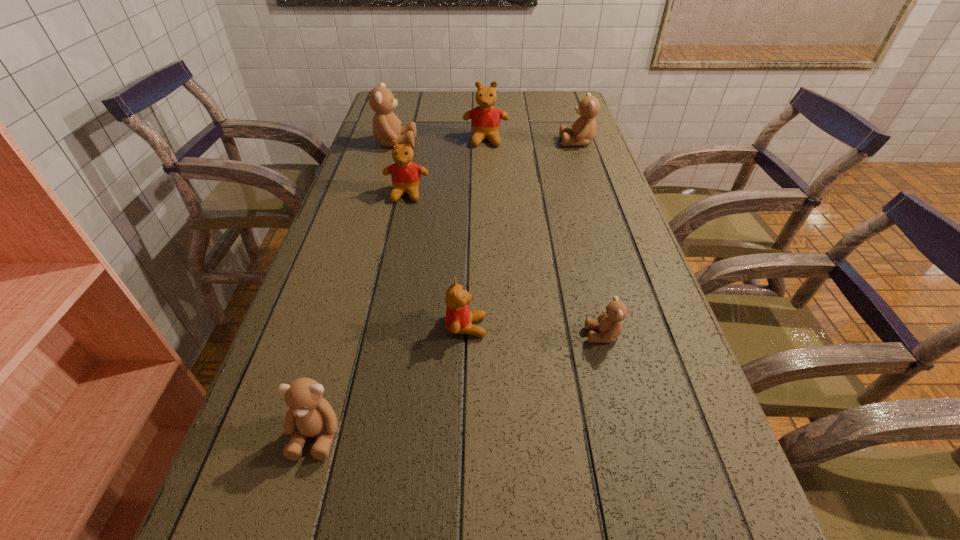
At what (x,y) coordinates should I click in order to perform the action: click on the biggest brown teddy bear. Please return your answer as a coordinate pair (x, y). The image size is (960, 540). Looking at the image, I should click on (386, 126).

I want to click on the farthest red teddy bear, so click(x=485, y=119).

Where is `the third smallest brown teddy bear`? The height and width of the screenshot is (540, 960). the third smallest brown teddy bear is located at coordinates (583, 130).

Locate an element on the screen. This screenshot has height=540, width=960. the fourth nearest object is located at coordinates (405, 174).

You are a GUI agent. You are given a task and a screenshot of the screen. Output one action in this format:
    pyautogui.click(x=<x>, y=<y>)
    Task: Click on the fourth farthest teddy bear
    The width and height of the screenshot is (960, 540).
    Given the screenshot: What is the action you would take?
    pyautogui.click(x=405, y=174)

In order to click on the smallest red teddy bear in this screenshot , I will do `click(459, 319)`.

Locate an element on the screen. The image size is (960, 540). the third biggest brown teddy bear is located at coordinates (309, 415).

The height and width of the screenshot is (540, 960). I want to click on the nearest object, so tap(309, 415).

This screenshot has width=960, height=540. I want to click on the shortest teddy bear, so click(609, 324).

The width and height of the screenshot is (960, 540). What are the coordinates of `the third farthest brown teddy bear` in the screenshot? It's located at (609, 324).